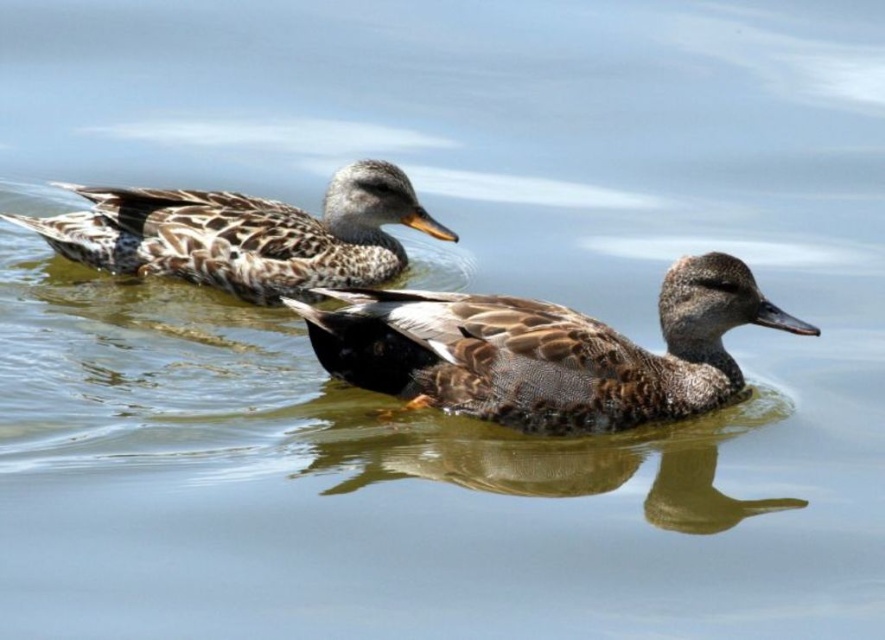
You are standing at the origin point of the coordinate system. You see two points, point (429, 387) and point (83, 227). Which point is closer to you?

Point (83, 227) is closer to you because it is behind point (429, 387).

You are observing two ducks in a serene pond. You notice the brown matte duck at center and the speckled feathered duck at upper left. Which duck is taller?

The brown matte duck at center is taller than the speckled feathered duck at upper left according to the description provided.